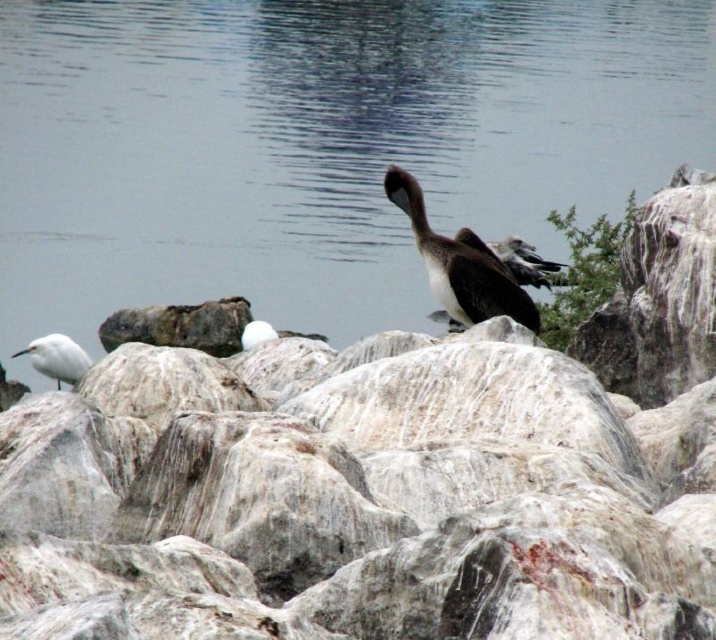
You are standing on the rocky shoreline and see the smooth gray rock at center and the white matte bird at left. Which object is positioned to the right of the other?

The smooth gray rock at center is positioned to the right of the white matte bird at left.

Consider the image. You are a photographer aiming to capture the brown matte bird at center without including the smooth gray rock at center in the frame. Based on their positions, is this possible?

The smooth gray rock at center is positioned under the brown matte bird at center, so it is likely blocking part of the bird. To avoid including the rock, you would need to adjust your angle or position to ensure the rock is not in the same plane as the bird.

You are a birdwatcher observing the scene from a distance. You notice a smooth gray rock at center. Based on its position, can you determine if it is closer to the water or the birds?

The smooth gray rock at center is located at point coordinates that place it closer to the water than the birds.